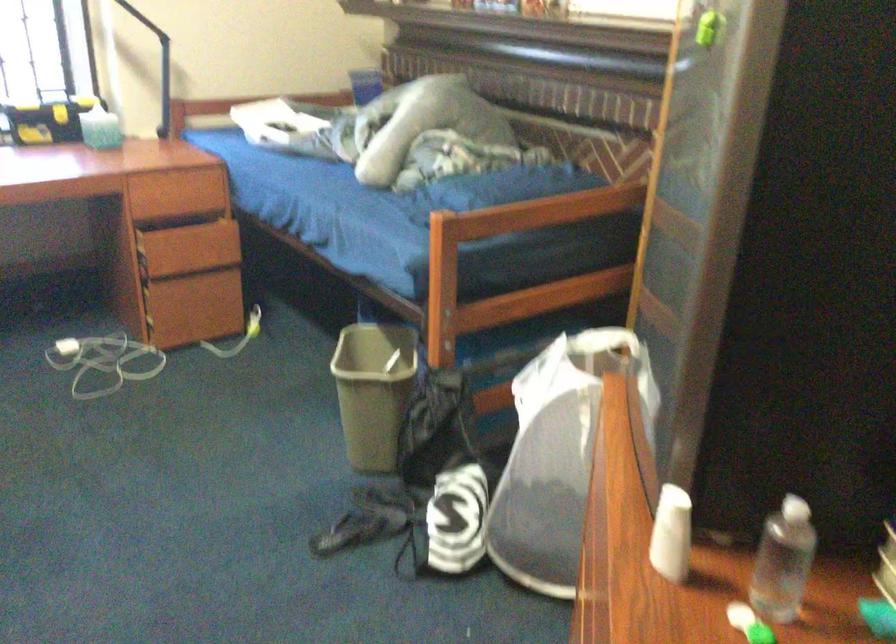
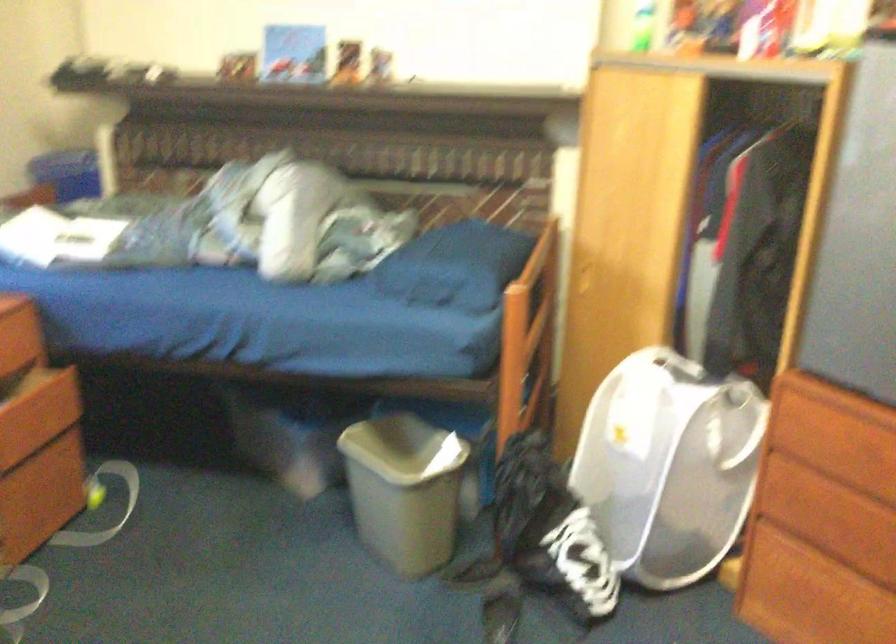
Where in the second image is the point corresponding to (464,474) from the first image?

(549, 529)